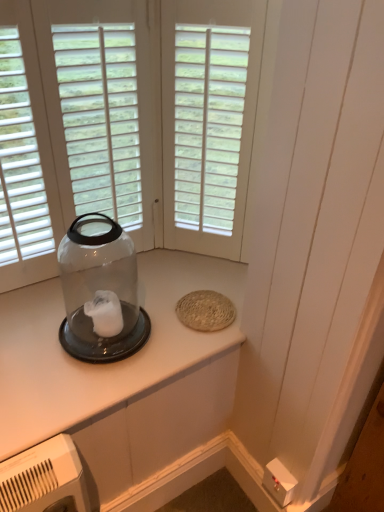
Measure the distance between white matte window at center and camera.

white matte window at center and camera are 3.59 feet apart.

Identify the location of clear plastic jar at upper left. click(x=122, y=375).

From a real-world perspective, between clear plastic jar at upper left and white matte window at center, who is vertically higher?

From a 3D spatial view, white matte window at center is above.

From the image's perspective, which object appears higher, clear plastic jar at upper left or white matte window at center?

white matte window at center appears higher in the image.

Looking at their sizes, would you say clear plastic jar at upper left is wider or thinner than white matte window at center?

clear plastic jar at upper left is wider than white matte window at center.

Is white matte window at center at the right side of transparent glass jar at left?

Yes, white matte window at center is to the right of transparent glass jar at left.

Is white matte window at center positioned far away from transparent glass jar at left?

No, there isn't a large distance between white matte window at center and transparent glass jar at left.

Is white matte window at center spatially inside transparent glass jar at left, or outside of it?

white matte window at center is outside transparent glass jar at left.

From the image's perspective, is white matte window at center positioned above or below transparent glass jar at left?

From the image's perspective, white matte window at center appears above transparent glass jar at left.

From the image's perspective, is clear plastic jar at upper left below transparent glass jar at left?

Correct, clear plastic jar at upper left appears lower than transparent glass jar at left in the image.

Between clear plastic jar at upper left and transparent glass jar at left, which one has smaller width?

Thinner between the two is transparent glass jar at left.

Identify the location of glass bottle above the clear plastic jar at upper left (from a real-world perspective). Image resolution: width=384 pixels, height=512 pixels. coord(100,291).

Can clear plastic jar at upper left be found inside white matte window at center?

No, clear plastic jar at upper left is located outside of white matte window at center.

Is white matte window at center to the right of clear plastic jar at upper left from the viewer's perspective?

Yes.

Which is behind, point (187, 149) or point (141, 258)?

The point (141, 258) is more distant.

How many degrees apart are the facing directions of white matte window at center and clear plastic jar at upper left?

The angle between the facing direction of white matte window at center and the facing direction of clear plastic jar at upper left is 45.6 degrees.

I want to click on window behind the transparent glass jar at left, so click(208, 123).

From a real-world perspective, is transparent glass jar at left under white matte window at center?

Correct, in the physical world, transparent glass jar at left is lower than white matte window at center.

Between point (131, 329) and point (197, 100), which one is positioned in front?

Point (131, 329)

Who is bigger, transparent glass jar at left or white matte window at center?

transparent glass jar at left.

Considering the relative positions of transparent glass jar at left and clear plastic jar at upper left in the image provided, is transparent glass jar at left to the right of clear plastic jar at upper left from the viewer's perspective?

Incorrect, transparent glass jar at left is not on the right side of clear plastic jar at upper left.

From a real-world perspective, which object rests below the other?

clear plastic jar at upper left is physically lower.

From the image's perspective, is transparent glass jar at left located above clear plastic jar at upper left?

Yes.

This screenshot has height=512, width=384. I want to click on countertop directly beneath the transparent glass jar at left (from a real-world perspective), so click(122, 375).

Where is `window lying on the right of clear plastic jar at upper left`? window lying on the right of clear plastic jar at upper left is located at coordinates (208, 123).

Image resolution: width=384 pixels, height=512 pixels. In order to click on window above the transparent glass jar at left (from a real-world perspective) in this screenshot , I will do `click(208, 123)`.

Looking at the image, which one is located closer to white matte window at center, transparent glass jar at left or clear plastic jar at upper left?

transparent glass jar at left is positioned closer to the anchor white matte window at center.

Which object lies further to the anchor point white matte window at center, clear plastic jar at upper left or transparent glass jar at left?

clear plastic jar at upper left.

Based on their spatial positions, is clear plastic jar at upper left or white matte window at center further from transparent glass jar at left?

white matte window at center is positioned further to the anchor transparent glass jar at left.

From the image, which object appears to be farther from clear plastic jar at upper left, white matte window at center or transparent glass jar at left?

The object further to clear plastic jar at upper left is white matte window at center.

Looking at the image, which one is located closer to transparent glass jar at left, white matte window at center or clear plastic jar at upper left?

clear plastic jar at upper left.

From the image, which object appears to be farther from clear plastic jar at upper left, transparent glass jar at left or white matte window at center?

white matte window at center is further to clear plastic jar at upper left.

What are the coordinates of `glass bottle that lies between white matte window at center and clear plastic jar at upper left from top to bottom` in the screenshot? It's located at (100, 291).